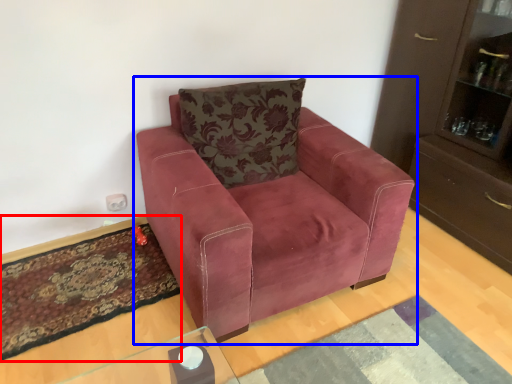
Question: Among these objects, which one is farthest to the camera, mat (highlighted by a red box) or chair (highlighted by a blue box)?

Choices:
 (A) mat
 (B) chair

Answer: (A)